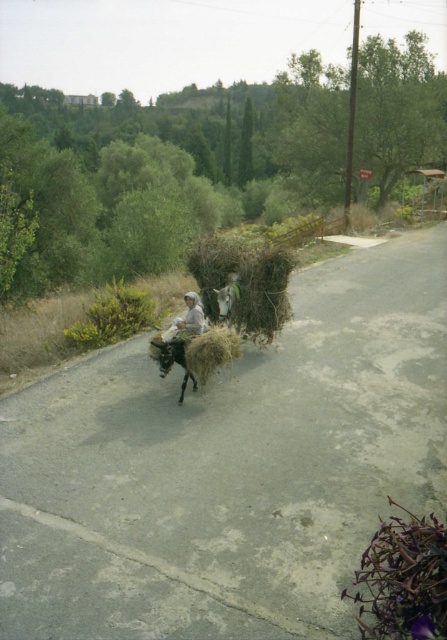
Can you confirm if light beige fabric at center is positioned to the left of dark brown fuzzy donkey at center?

Incorrect, light beige fabric at center is not on the left side of dark brown fuzzy donkey at center.

Between light beige fabric at center and dark brown fuzzy donkey at center, which one has less height?

light beige fabric at center

Looking at this image, who is more distant from viewer, (202, 316) or (161, 362)?

The point (202, 316) is more distant.

What are the coordinates of `light beige fabric at center` in the screenshot? It's located at (186, 321).

Does dark brown fuzzy donkey at center appear over brown fuzzy donkey at center?

Incorrect, dark brown fuzzy donkey at center is not positioned above brown fuzzy donkey at center.

Which is more to the left, dark brown fuzzy donkey at center or brown fuzzy donkey at center?

dark brown fuzzy donkey at center

Is point (184, 352) farther from camera compared to point (223, 296)?

No, it is not.

Where is `dark brown fuzzy donkey at center`? The height and width of the screenshot is (640, 447). dark brown fuzzy donkey at center is located at coordinates (172, 360).

Does light beige fabric at center appear over brown fuzzy donkey at center?

No.

Does point (184, 333) come behind point (222, 314)?

No, (184, 333) is closer to viewer.

Where is `light beige fabric at center`? light beige fabric at center is located at coordinates pos(186,321).